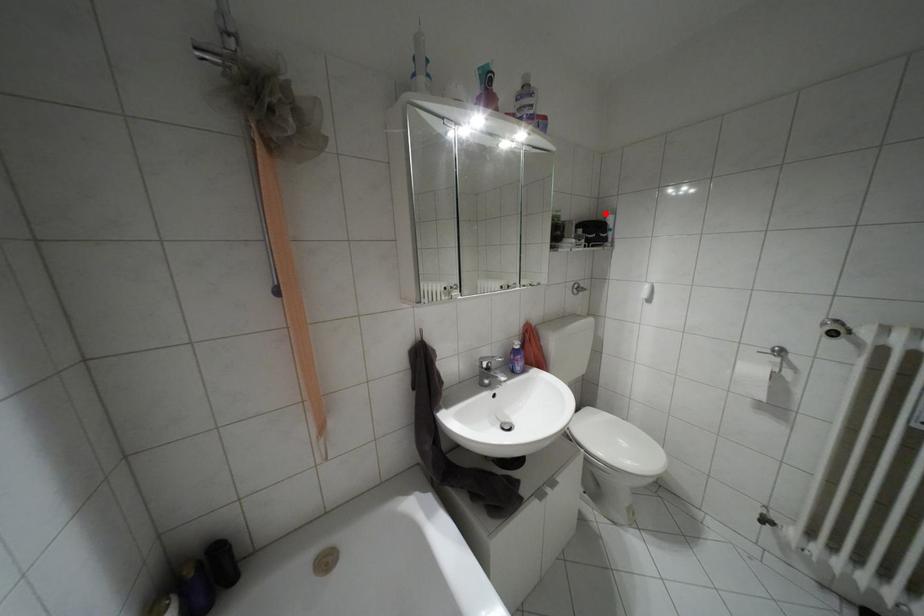
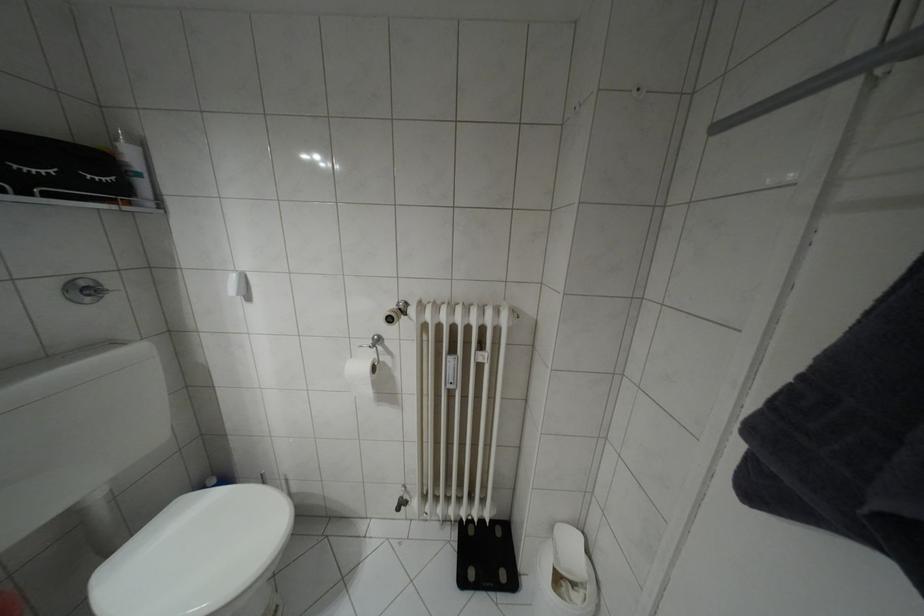
In the second image, find the point that corresponds to the highlighted location in the first image.

(116, 139)